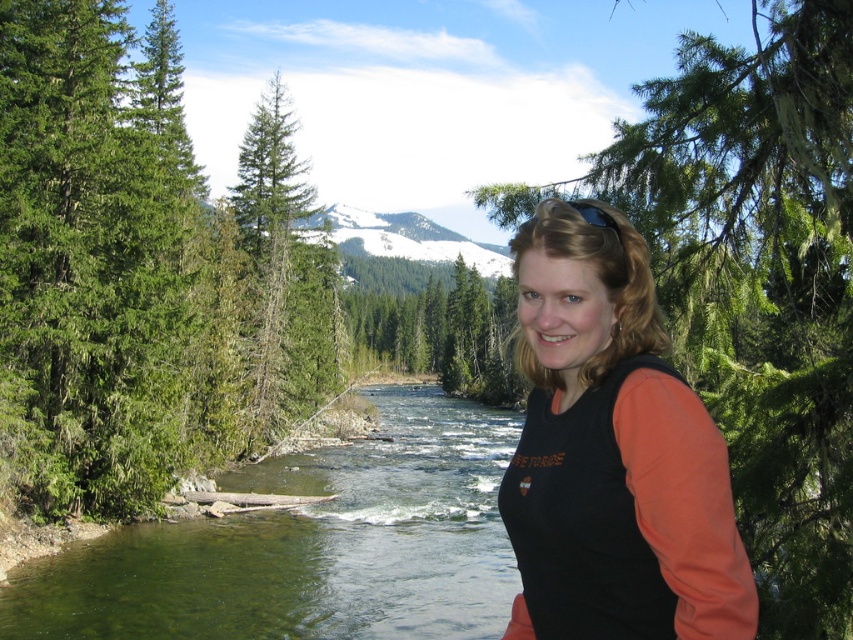
Question: Is green leafy tree at center positioned behind green smooth water at center?

Choices:
 (A) no
 (B) yes

Answer: (A)

Question: Can you confirm if black matte shirt at center is positioned to the right of green matte tree at center?

Choices:
 (A) no
 (B) yes

Answer: (B)

Question: Does green leafy tree at center have a greater width compared to green smooth water at center?

Choices:
 (A) yes
 (B) no

Answer: (A)

Question: Which point is farther to the camera?

Choices:
 (A) green leafy tree at center
 (B) green smooth water at center
 (C) green matte tree at center
 (D) black matte shirt at center

Answer: (C)

Question: Which point appears closest to the camera in this image?

Choices:
 (A) (817, 211)
 (B) (589, 589)
 (C) (463, 307)
 (D) (202, 305)

Answer: (B)

Question: Considering the real-world distances, which object is closest to the green coniferous trees at left?

Choices:
 (A) green leafy tree at center
 (B) green matte tree at center

Answer: (A)